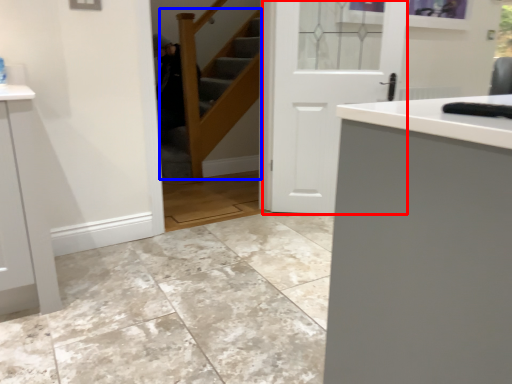
Question: Which object appears closest to the camera in this image, door (highlighted by a red box) or stairwell (highlighted by a blue box)?

Choices:
 (A) door
 (B) stairwell

Answer: (B)